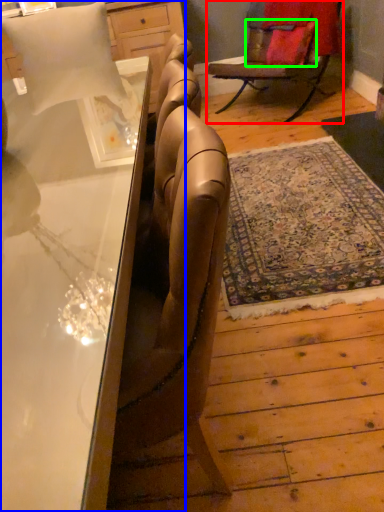
Question: Based on their relative distances, which object is farther from chair (highlighted by a red box)? Choose from desk (highlighted by a blue box) and pillow (highlighted by a green box).

Choices:
 (A) desk
 (B) pillow

Answer: (A)